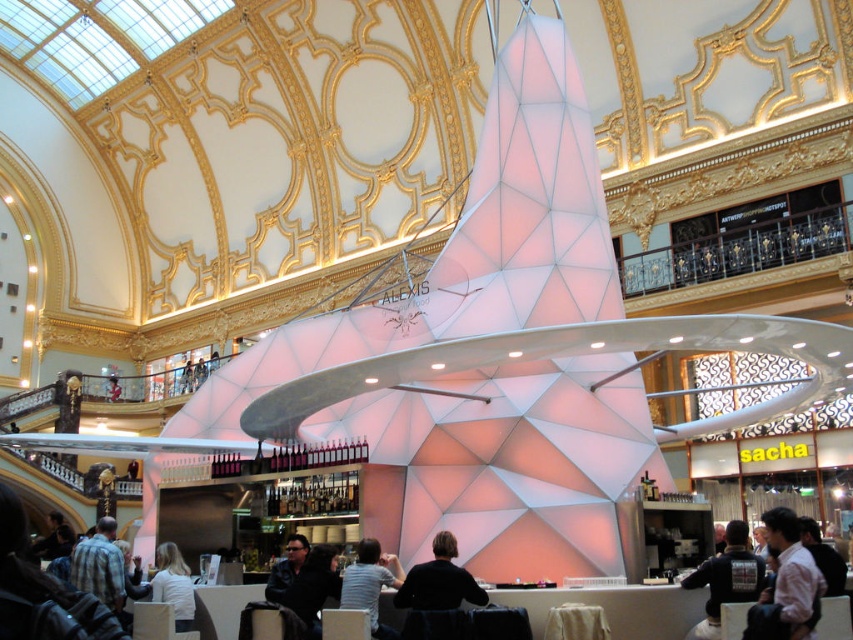
You are trying to decide which shirt to wear for a casual day out. Both the striped shirt at center and the white matte shirt at lower center are options. Based on their sizes, which one would you choose if you prefer a more oversized look?

The striped shirt at center has a larger width than the white matte shirt at lower center, so you should choose the striped shirt at center for an oversized look.

You are standing in the luxurious interior space with the gold ceiling. There is a striped shirt at center. Where exactly is the striped shirt located in terms of coordinates?

The striped shirt at center is located at point coordinates (370, 582).

You are standing in the center of the room and see the dark blue jacket at lower right and the plaid shirt at lower left. Which item is positioned to the right side of the room?

The dark blue jacket at lower right is positioned to the right side of the room because it is to the right of the plaid shirt at lower left.